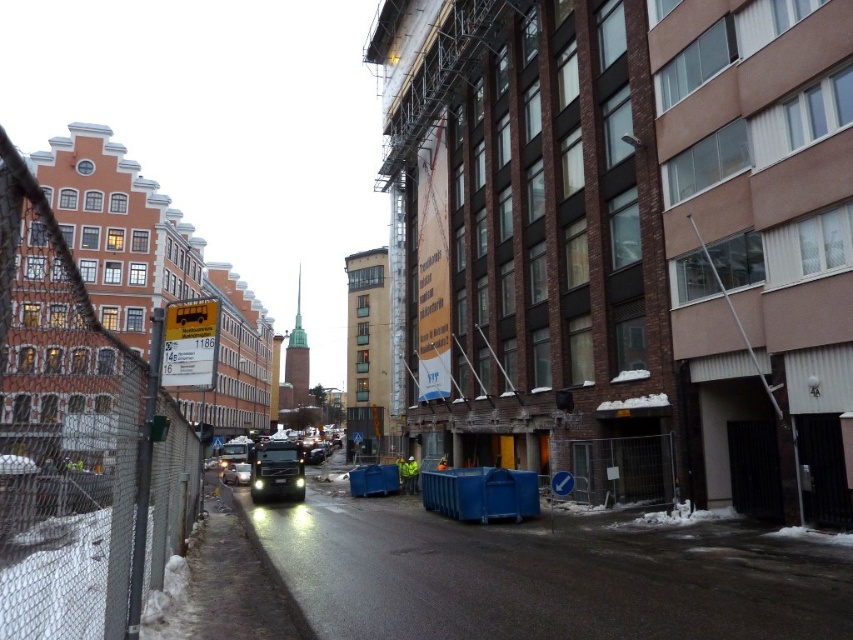
Consider the image. Does metallic chain-link fence at left have a lesser height compared to shiny silver car at center?

No, metallic chain-link fence at left is not shorter than shiny silver car at center.

Who is higher up, metallic chain-link fence at left or shiny silver car at center?

metallic chain-link fence at left is higher up.

The image size is (853, 640). What do you see at coordinates (73, 440) in the screenshot? I see `metallic chain-link fence at left` at bounding box center [73, 440].

Where is `metallic chain-link fence at left`? The image size is (853, 640). metallic chain-link fence at left is located at coordinates (73, 440).